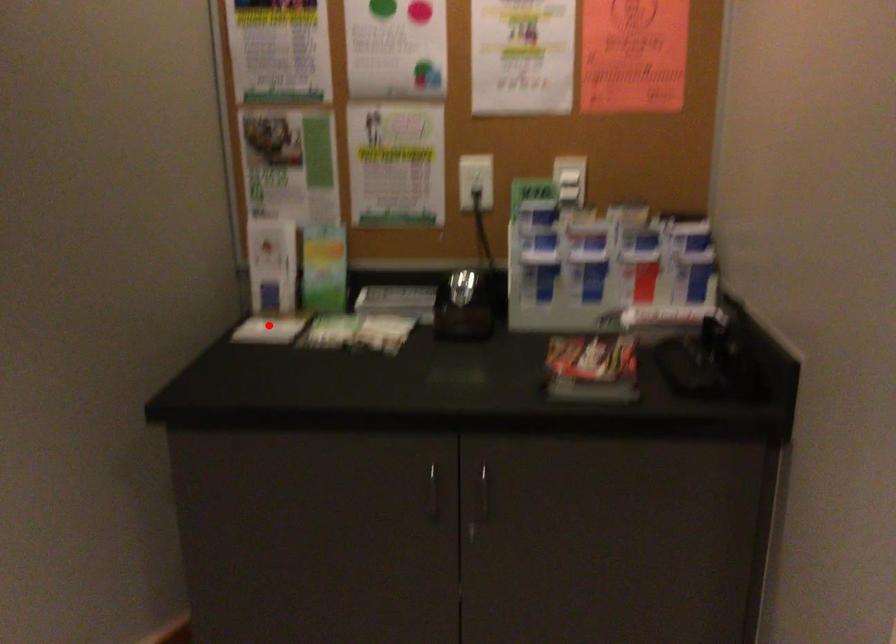
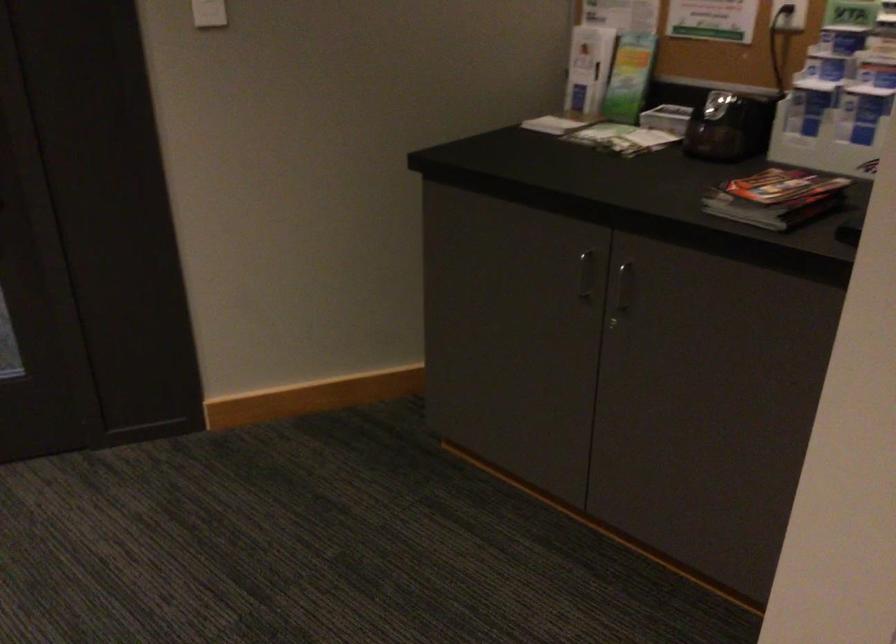
Where in the second image is the point corresponding to the highlighted location from the first image?

(556, 122)